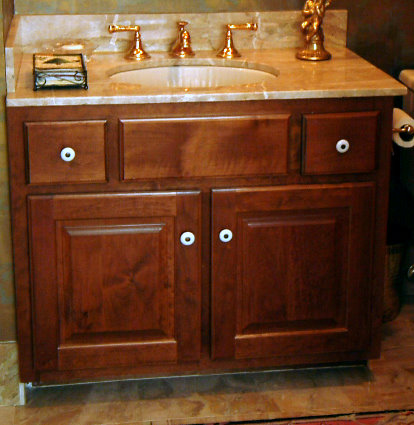
Where is `right cabinet door handle`? This screenshot has width=414, height=425. right cabinet door handle is located at coordinates (226, 234).